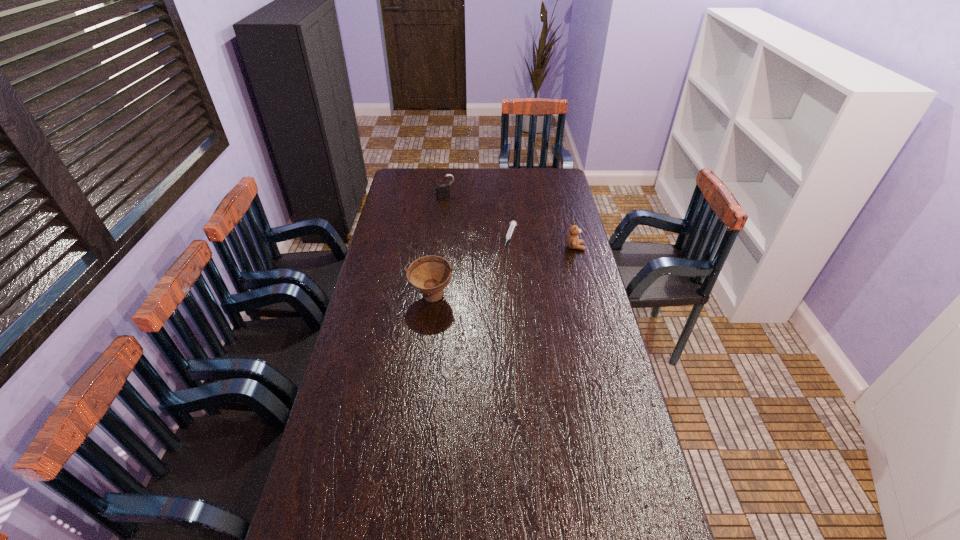
At what (x,y) coordinates should I click in order to perform the action: click on vacant space on the desktop that is between the soup bowl and the teddy bear and is positioned at the needle end of the shortest object. Please return your answer as a coordinate pair (x, y). Looking at the image, I should click on (496, 275).

At what (x,y) coordinates should I click in order to perform the action: click on free space on the desktop that is between the nearest object and the rightmost object and is positioned with the keyhole on the front of the farthest object. Please return your answer as a coordinate pair (x, y). The height and width of the screenshot is (540, 960). Looking at the image, I should click on (498, 274).